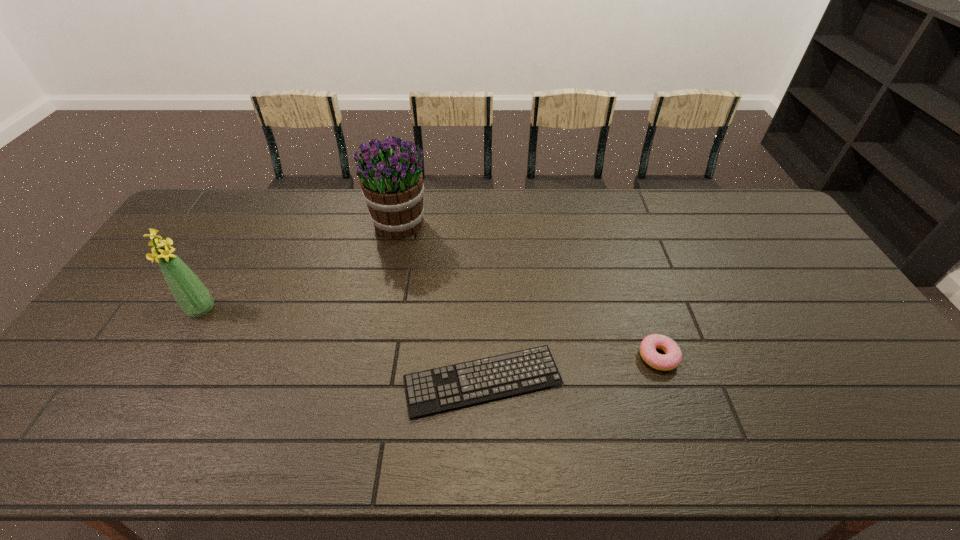
Image resolution: width=960 pixels, height=540 pixels. Identify the location of the right bouquet. (390, 175).

You are a GUI agent. You are given a task and a screenshot of the screen. Output one action in this format:
    pyautogui.click(x=<x>, y=<y>)
    Task: Click on the farthest object
    The image size is (960, 540).
    Given the screenshot: What is the action you would take?
    pyautogui.click(x=390, y=175)

Locate an element on the screen. the second farthest object is located at coordinates (192, 296).

I want to click on the leftmost object, so click(192, 296).

The width and height of the screenshot is (960, 540). Identify the location of doughnut. (670, 360).

Identify the location of the rightmost object. Image resolution: width=960 pixels, height=540 pixels. (670, 360).

The height and width of the screenshot is (540, 960). Identify the location of computer keyboard. (444, 388).

The height and width of the screenshot is (540, 960). What are the coordinates of `vacant space located 0.170m on the left of the farther bouquet` in the screenshot? It's located at (319, 224).

At what (x,y) coordinates should I click in order to perform the action: click on vacant area situated 0.060m on the front-facing side of the second farthest object. Please return your answer as a coordinate pair (x, y). The width and height of the screenshot is (960, 540). Looking at the image, I should click on (185, 338).

I want to click on vacant area situated on the left of the third tallest object, so click(x=604, y=356).